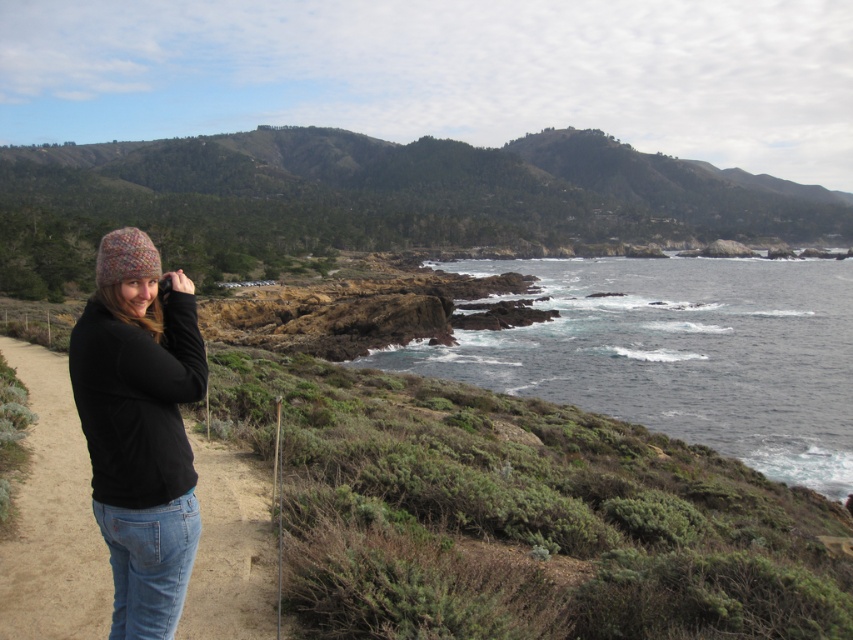
Based on the photo, you are a photographer planning to capture the scenic coastal landscape. You notice the black fabric path at lower left and the knitted woolen hat at left in your viewfinder. Which object should you adjust your focus on if you want to emphasize the larger element in the scene?

The black fabric path at lower left has a larger size compared to the knitted woolen hat at left, so you should adjust your focus on the black fabric path at lower left to emphasize the larger element in the scene.

You are a hiker planning to take a photo of the green grassy hillside at upper center and the knitted wool hat at left. Which object should you focus on first if you want to capture both in a single frame without moving the camera?

You should focus on the green grassy hillside at upper center first because its width is larger than the knitted wool hat at left, so it will occupy more space in the frame and ensure both are included.

You are a photographer standing on the black fabric path at lower left and want to take a photo of the knitted woolen hat at left. Which object is closer to you, the photographer, so that it will appear larger in the photo?

The black fabric path at lower left is closer to you, so it will appear larger in the photo than the knitted woolen hat at left which is behind it.